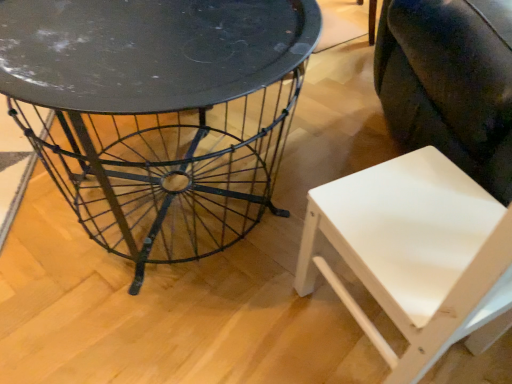
Identify the location of vacant space that is in between white matte chair at lower right and metallic wire table at center. (240, 307).